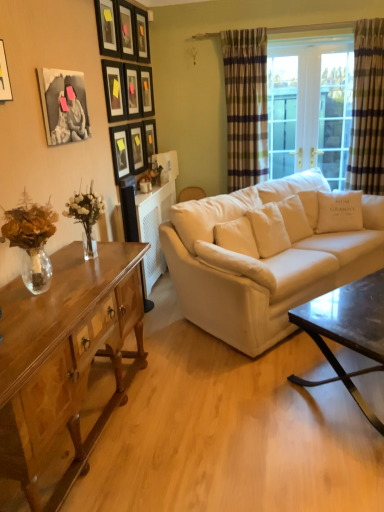
Question: Is point (147, 159) closer or farther from the camera than point (69, 102)?

Choices:
 (A) closer
 (B) farther

Answer: (B)

Question: Considering the relative positions of matte black picture frame at center, the 1th picture frame positioned from the back, and black matte picture frame at upper left, the tenth picture frame when ordered from back to front, in the image provided, is matte black picture frame at center, the 1th picture frame positioned from the back, to the left or to the right of black matte picture frame at upper left, the tenth picture frame when ordered from back to front,?

Choices:
 (A) right
 (B) left

Answer: (A)

Question: Which object is the closest to the white fabric pillow at center, positioned as the second pillow in top-to-bottom order?

Choices:
 (A) light brown wooden coffee table at lower left, which appears as the 1th coffee table when viewed from the left
 (B) matte black picture frame at upper center, which is counted as the eighth picture frame, starting from the front
 (C) matte black picture frame at upper center, positioned as the sixth picture frame in front-to-back order
 (D) matte black picture frame at upper center, which ranks as the 4th picture frame in front-to-back order
 (E) matte black picture frame at upper center, which ranks as the 4th picture frame in back-to-front order

Answer: (A)

Question: Estimate the real-world distances between objects in this image. Which object is farther from the white fabric couch at center?

Choices:
 (A) matte black picture frame at upper center, which is counted as the eighth picture frame, starting from the front
 (B) matte black picture frame at center, the 1th picture frame positioned from the back
 (C) shiny dark wood coffee table at lower right, placed as the 1th coffee table when sorted from right to left
 (D) wooden picture frame at upper left, the 6th picture frame in the back-to-front sequence
 (E) plaid fabric curtain at right, the 1th curtain when ordered from right to left

Answer: (A)